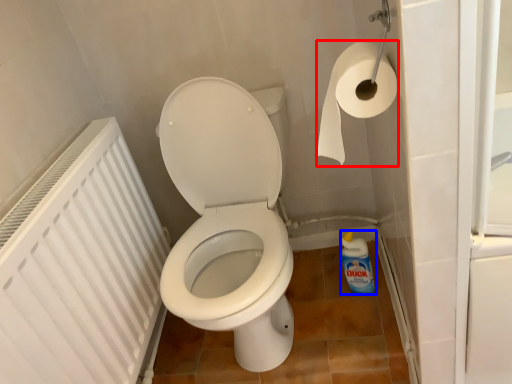
Question: Which point is further to the camera, toilet paper (highlighted by a red box) or cleaning product (highlighted by a blue box)?

Choices:
 (A) toilet paper
 (B) cleaning product

Answer: (B)